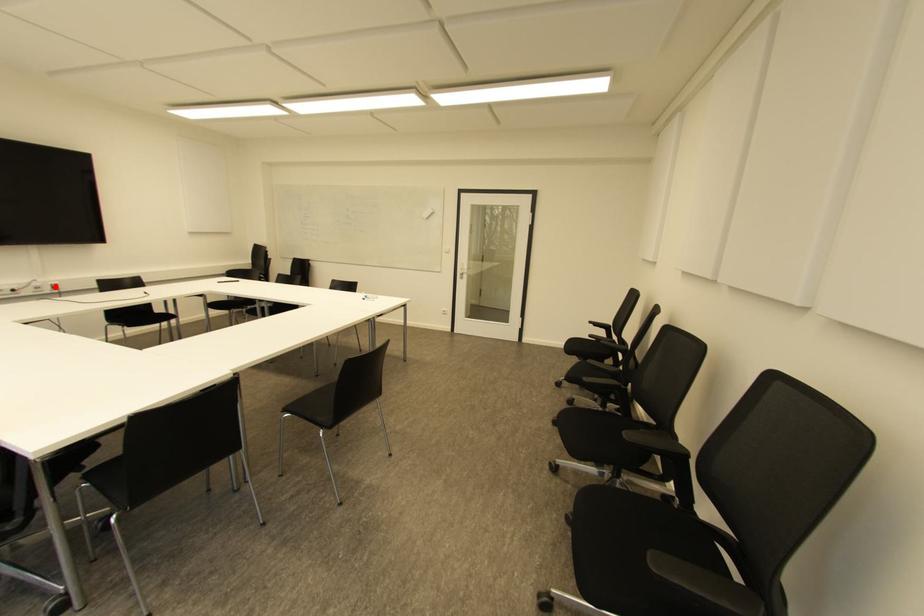
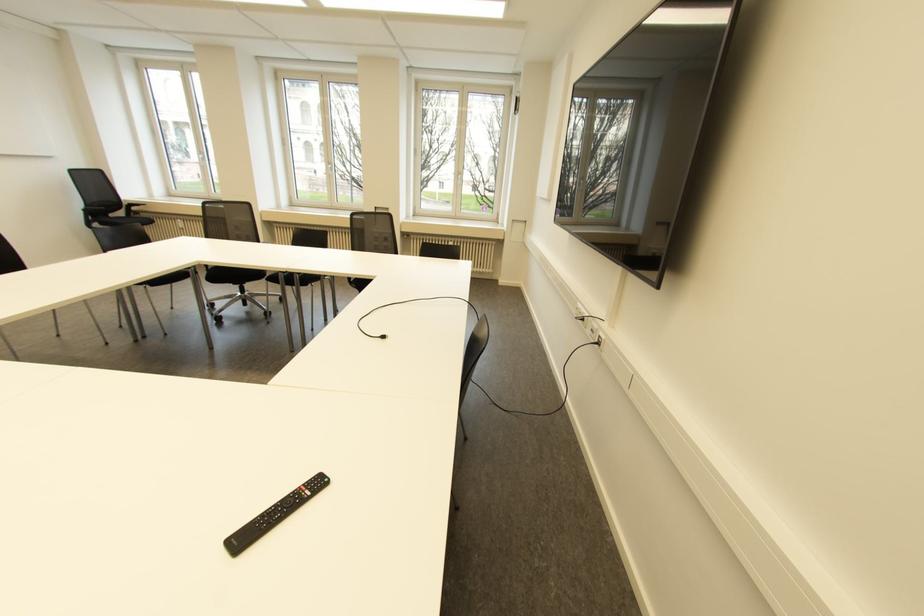
The point at the highlighted location is marked in the first image. Where is the corresponding point in the second image?

(598, 342)